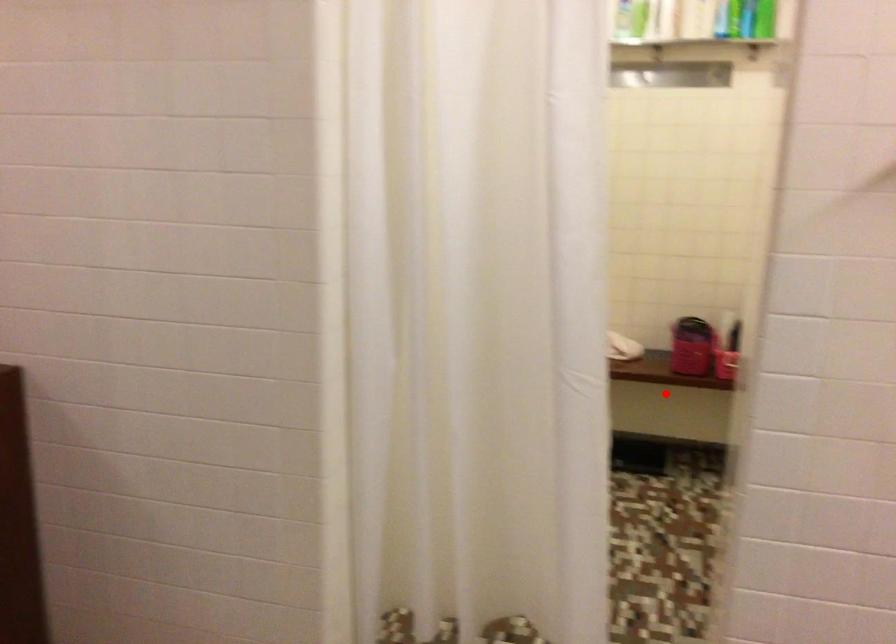
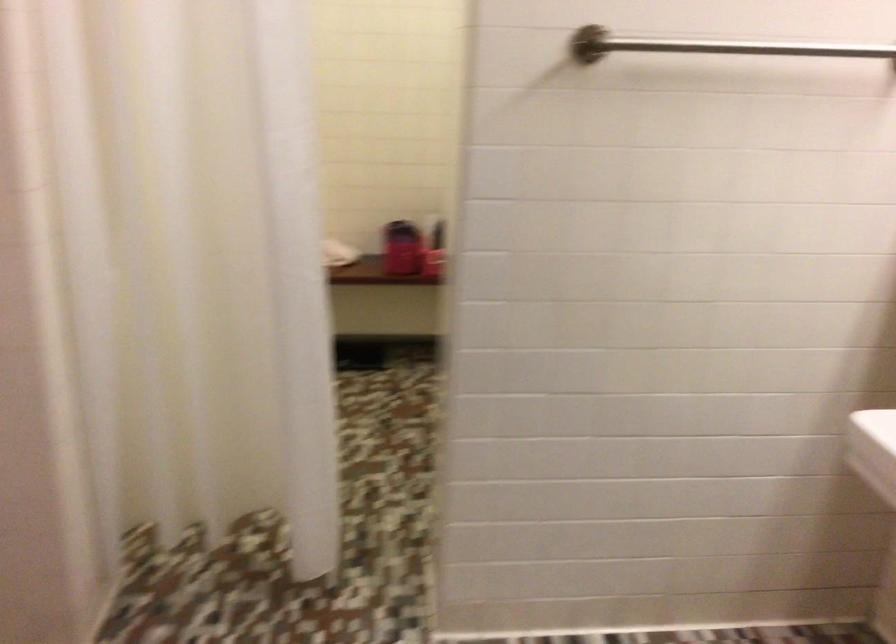
Question: I am providing you with two images of the same scene from different viewpoints. Image1 has a red point marked. In image2, the corresponding 3D location appears at what relative position? Reply with the corresponding letter.

Choices:
 (A) Closer
 (B) Farther

Answer: (B)